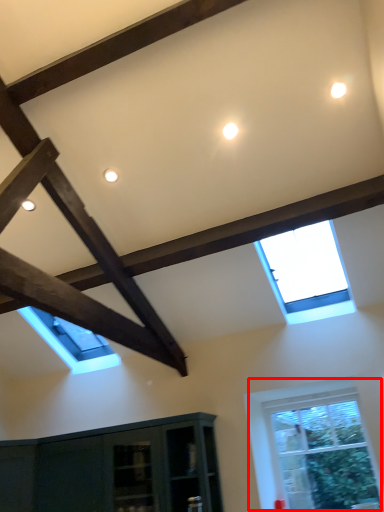
Question: From the image's perspective, what is the correct spatial positioning of window (annotated by the red box) in reference to window?

Choices:
 (A) below
 (B) above

Answer: (A)